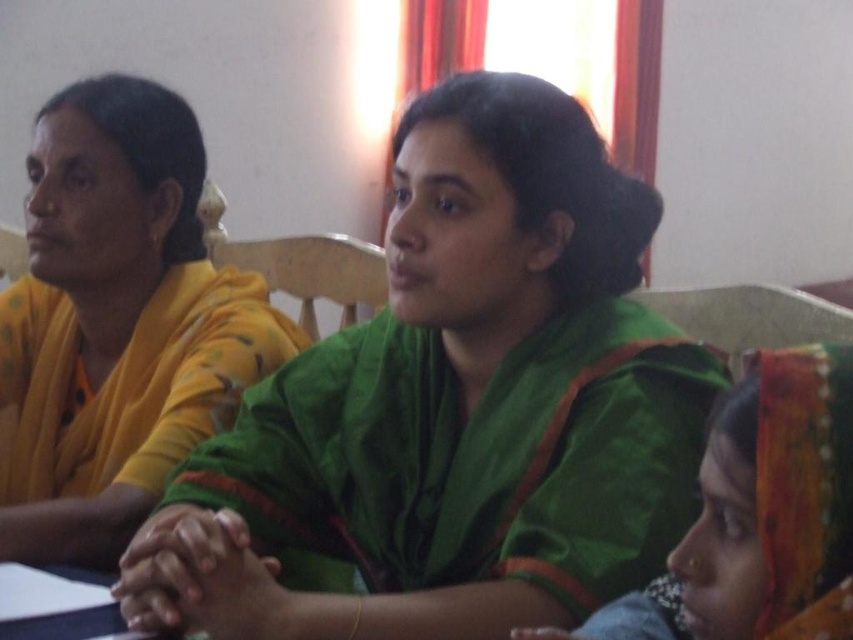
Based on the coordinates provided, which object is located at point (457, 406)?

The point (457, 406) corresponds to the green silk saree at center.

Based on the scene description, which sari is positioned higher between the green silk saree at center and the green velvet sari at center?

The green silk saree at center is positioned higher than the green velvet sari at center according to the description.

You are an interior designer observing the seating arrangement. The yellow fabric saree at left and the green velvet sari at center are part of the decor. Which sari has a greater width?

The yellow fabric saree at left has a greater width than the green velvet sari at center according to the description.